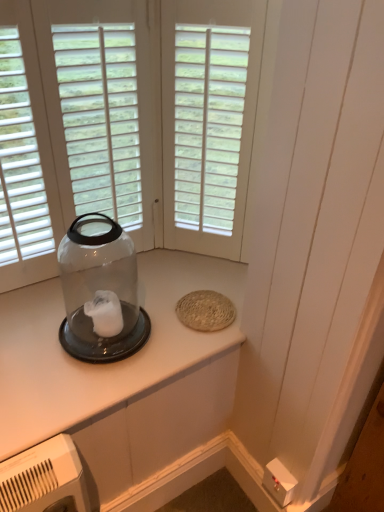
Locate an element on the screen. The image size is (384, 512). free space to the back side of transparent glass jar at left is located at coordinates (123, 287).